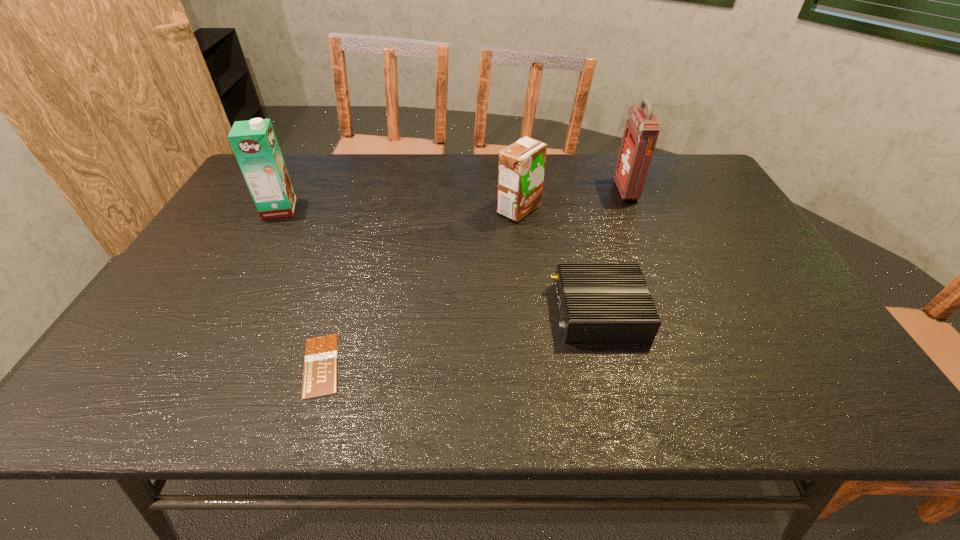
Locate an element on the screen. Image resolution: width=960 pixels, height=540 pixels. free space between the taller carton and the shortest object is located at coordinates (300, 287).

The height and width of the screenshot is (540, 960). Identify the location of vacant space that is in between the taller carton and the second shortest object. (440, 260).

Identify the location of vacant space that is in between the second shortest object and the third tallest object. (559, 260).

The width and height of the screenshot is (960, 540). I want to click on free space between the right carton and the left carton, so click(399, 210).

Image resolution: width=960 pixels, height=540 pixels. I want to click on vacant area between the taller carton and the shortest object, so click(300, 287).

Identify the location of vacant space that's between the second object from left to right and the right carton. The width and height of the screenshot is (960, 540). (420, 287).

Where is `empty space that is in between the first-aid kit and the fourth tallest object`? This screenshot has width=960, height=540. empty space that is in between the first-aid kit and the fourth tallest object is located at coordinates (612, 251).

Locate an element on the screen. Image resolution: width=960 pixels, height=540 pixels. object that can be found as the fourth closest to the leftmost object is located at coordinates (642, 128).

Select which object is the closest to the rightmost object. Please provide its 2D coordinates. Your answer should be formatted as a tuple, i.e. [(x, y)], where the tuple contains the x and y coordinates of a point satisfying the conditions above.

[(521, 168)]

Locate an element on the screen. The height and width of the screenshot is (540, 960). vacant position in the image that satisfies the following two spatial constraints: 1. on the front-facing side of the rightmost object; 2. on the front side of the fourth object from right to left is located at coordinates (700, 365).